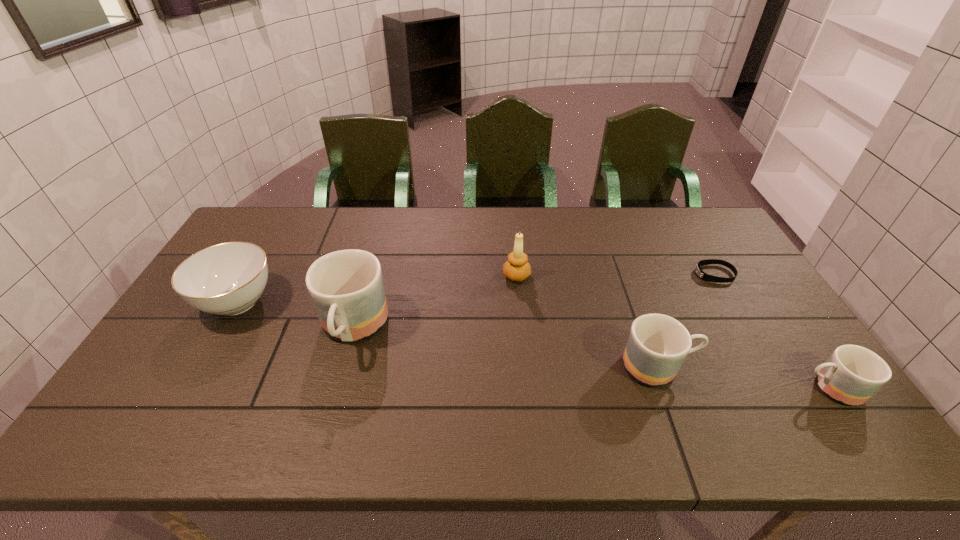
Find the location of `free point between the shortest mug and the wristband`. free point between the shortest mug and the wristband is located at coordinates (773, 331).

Identify the location of vacant space that is in between the leftmost mug and the candle_holder. (435, 302).

Locate an element on the screen. The image size is (960, 540). free spot between the second shortest mug and the rightmost mug is located at coordinates (745, 377).

Image resolution: width=960 pixels, height=540 pixels. What are the coordinates of `free space between the leftmost mug and the second tallest mug` in the screenshot? It's located at (506, 348).

What are the coordinates of `unoccupied position between the tallest mug and the candle_holder` in the screenshot? It's located at (435, 302).

At what (x,y) coordinates should I click in order to perform the action: click on free space between the third object from right to left and the fourth object from right to left. Please return your answer as a coordinate pair (x, y). Looking at the image, I should click on (588, 321).

Image resolution: width=960 pixels, height=540 pixels. In order to click on object that is the closest to the candle_holder in this screenshot , I will do `click(657, 346)`.

At what (x,y) coordinates should I click in order to perform the action: click on object that is the fifth nearest to the rightmost mug. Please return your answer as a coordinate pair (x, y). The height and width of the screenshot is (540, 960). Looking at the image, I should click on (225, 279).

Identify which mug is the nearest to the second tallest mug. Please provide its 2D coordinates. Your answer should be formatted as a tuple, i.e. [(x, y)], where the tuple contains the x and y coordinates of a point satisfying the conditions above.

[(852, 374)]

This screenshot has height=540, width=960. What are the coordinates of `mug that stands as the third closest to the chinaware` in the screenshot? It's located at (852, 374).